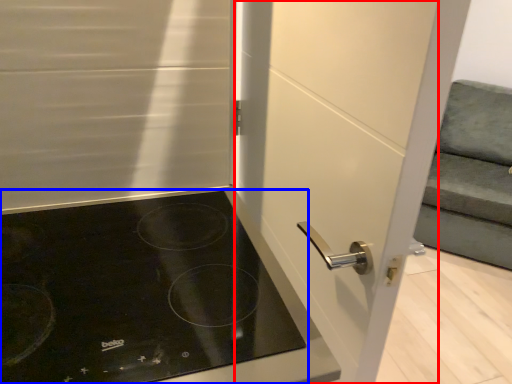
Question: Which of the following is the closest to the observer, screen door (highlighted by a red box) or gas stove (highlighted by a blue box)?

Choices:
 (A) screen door
 (B) gas stove

Answer: (B)